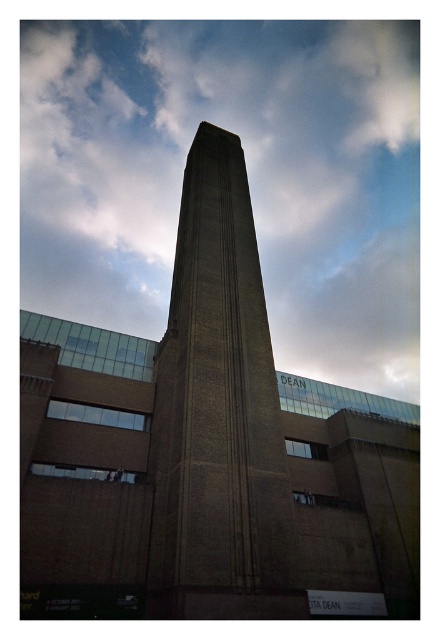
Question: Considering the relative positions of cloudy sky at upper center and brown stone tower at center in the image provided, where is cloudy sky at upper center located with respect to brown stone tower at center?

Choices:
 (A) above
 (B) below

Answer: (A)

Question: Does cloudy sky at upper center appear on the right side of brown stone tower at center?

Choices:
 (A) no
 (B) yes

Answer: (A)

Question: Which point appears closest to the camera in this image?

Choices:
 (A) (102, 202)
 (B) (209, 134)

Answer: (B)

Question: Is cloudy sky at upper center smaller than brown stone tower at center?

Choices:
 (A) yes
 (B) no

Answer: (B)

Question: Which point is closer to the camera?

Choices:
 (A) (249, 467)
 (B) (279, 342)

Answer: (A)